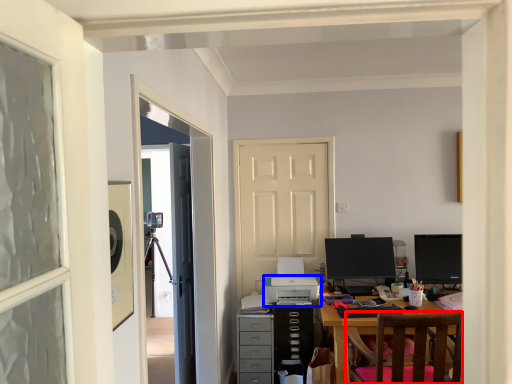
Question: Which object is closer to the camera taking this photo, chair (highlighted by a red box) or printer (highlighted by a blue box)?

Choices:
 (A) chair
 (B) printer

Answer: (A)